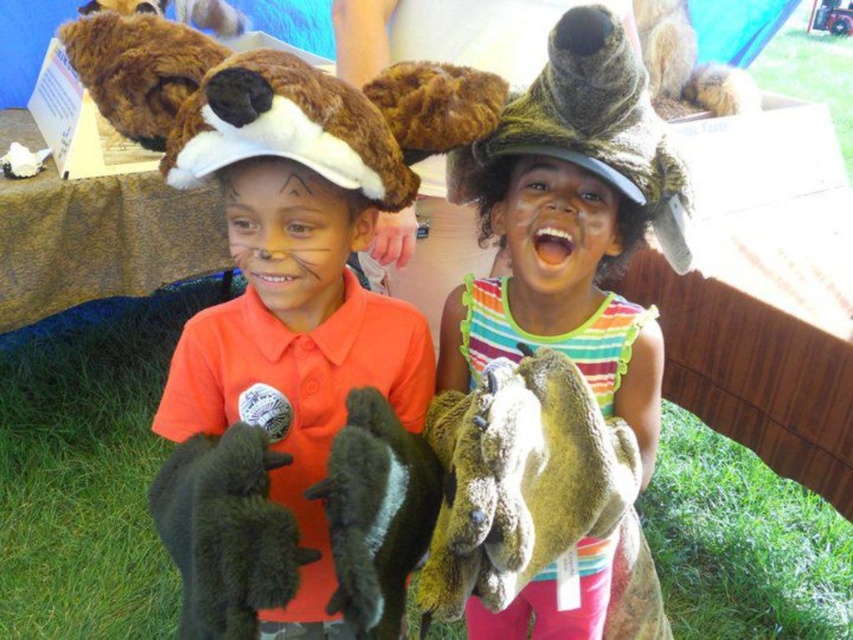
You are a photographer trying to capture a clear photo of the dark green plush fish at center. However, the dark green plush rabbit at lower left is blocking your view. Can you adjust your angle to avoid the rabbit?

The dark green plush rabbit at lower left is positioned under the dark green plush fish at center, so you can move your camera angle slightly upward to avoid the rabbit and capture the fish clearly.

You are a photographer trying to capture a photo of the dark green plush fish at center while ensuring the fuzzy brown hat at upper left is visible in the frame. Based on their positions, can you position yourself so both objects are in the shot without moving any of them?

Yes, since the fuzzy brown hat at upper left is to the left of the dark green plush fish at center, positioning yourself to the left of both objects would allow both to be in the frame.

You are a photographer trying to capture the perfect shot of the green fuzzy puppet at center. Based on the scene description, what coordinates should you aim your camera at to ensure the puppet is centered in your photo?

The green fuzzy puppet at center is located at coordinates point (521, 483), so you should aim your camera at those coordinates to center it in your photo.